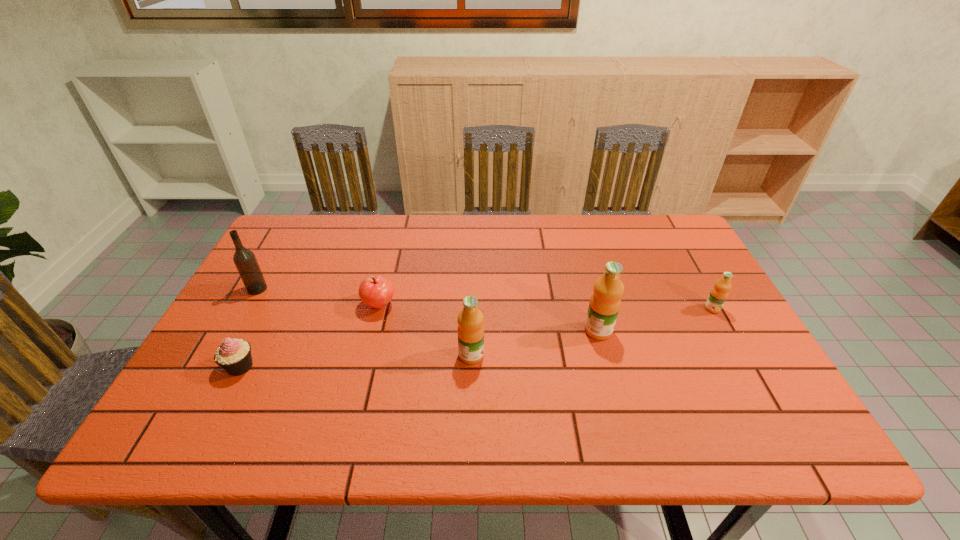
You are a GUI agent. You are given a task and a screenshot of the screen. Output one action in this format:
    pyautogui.click(x=<x>, y=<y>)
    Task: Click on the fourth object from left to right
    This screenshot has width=960, height=540.
    Given the screenshot: What is the action you would take?
    pyautogui.click(x=470, y=319)

Locate an element on the screen. Image resolution: width=960 pixels, height=540 pixels. the second shortest orange juice is located at coordinates (470, 319).

You are a GUI agent. You are given a task and a screenshot of the screen. Output one action in this format:
    pyautogui.click(x=<x>, y=<y>)
    Task: Click on the fifth object from left to right
    The height and width of the screenshot is (540, 960).
    Given the screenshot: What is the action you would take?
    (605, 301)

This screenshot has width=960, height=540. Find the location of `the second nearest orange juice`. the second nearest orange juice is located at coordinates (605, 301).

Where is `the third shortest object`? Image resolution: width=960 pixels, height=540 pixels. the third shortest object is located at coordinates (719, 293).

Locate an element on the screen. Image resolution: width=960 pixels, height=540 pixels. the rightmost object is located at coordinates (719, 293).

Locate an element on the screen. This screenshot has width=960, height=540. vodka is located at coordinates (244, 259).

This screenshot has height=540, width=960. Identify the location of cupcake. (234, 355).

This screenshot has width=960, height=540. In order to click on the fourth object from right to left in this screenshot , I will do `click(377, 291)`.

The height and width of the screenshot is (540, 960). In order to click on vacant region located 0.250m on the label of the leftmost orange juice in this screenshot , I will do `click(589, 355)`.